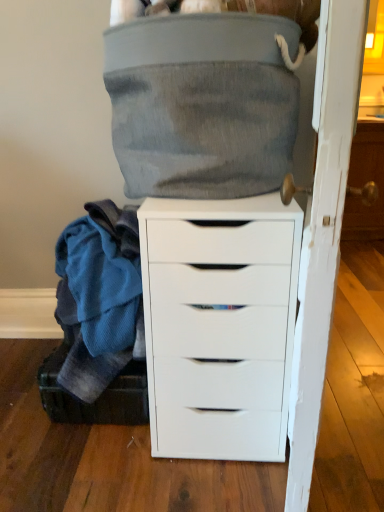
Question: Looking at their shapes, would you say black fabric shoe box at lower left is wider or thinner than white wood door at right?

Choices:
 (A) wide
 (B) thin

Answer: (A)

Question: From their relative heights in the image, would you say black fabric shoe box at lower left is taller or shorter than white wood door at right?

Choices:
 (A) tall
 (B) short

Answer: (B)

Question: Considering the real-world distances, which object is farthest from the white matte chest of drawers at center?

Choices:
 (A) black fabric shoe box at lower left
 (B) white wood door at right

Answer: (A)

Question: Which object is positioned farthest from the white matte chest of drawers at center?

Choices:
 (A) black fabric shoe box at lower left
 (B) white wood door at right

Answer: (A)